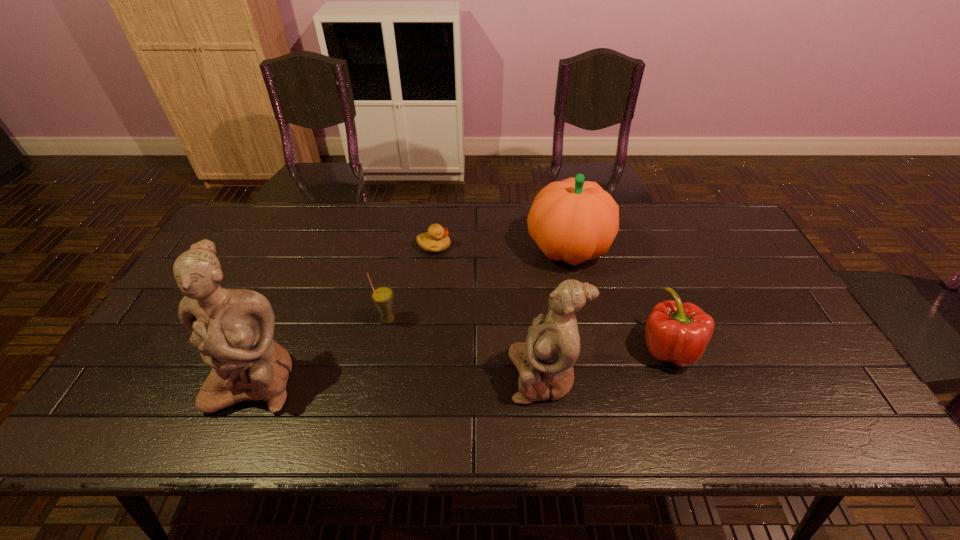
Identify the location of the taller figurine. (233, 329).

Locate an element on the screen. Image resolution: width=960 pixels, height=540 pixels. the left figurine is located at coordinates (233, 329).

You are a GUI agent. You are given a task and a screenshot of the screen. Output one action in this format:
    pyautogui.click(x=<x>, y=<y>)
    Task: Click on the shorter figurine
    
    Given the screenshot: What is the action you would take?
    pyautogui.click(x=545, y=361)

Identify the location of duckling. The height and width of the screenshot is (540, 960). (436, 240).

This screenshot has height=540, width=960. Identify the location of the shortest object. (436, 240).

What are the coordinates of `pumpkin` in the screenshot? It's located at (572, 220).

Locate an element on the screen. straw for drinking is located at coordinates (382, 296).

In order to click on pepper in this screenshot , I will do `click(676, 332)`.

Where is `free region located 0.320m on the front-facing side of the right figurine`? free region located 0.320m on the front-facing side of the right figurine is located at coordinates (378, 376).

You are a GUI agent. You are given a task and a screenshot of the screen. Output one action in this format:
    pyautogui.click(x=<x>, y=<y>)
    Task: Click on the vacant space located on the front-facing side of the right figurine
    The image size is (960, 540).
    Given the screenshot: What is the action you would take?
    pyautogui.click(x=407, y=376)